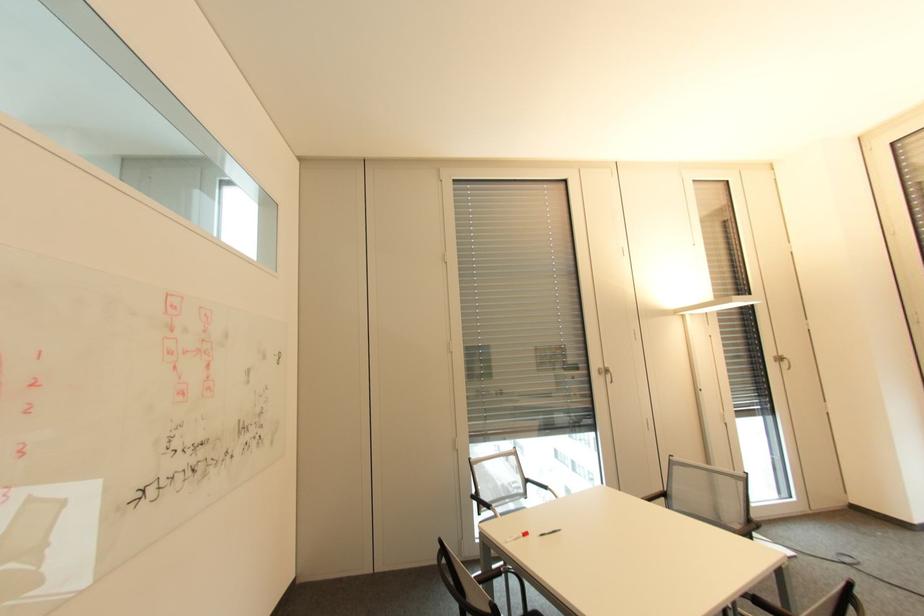
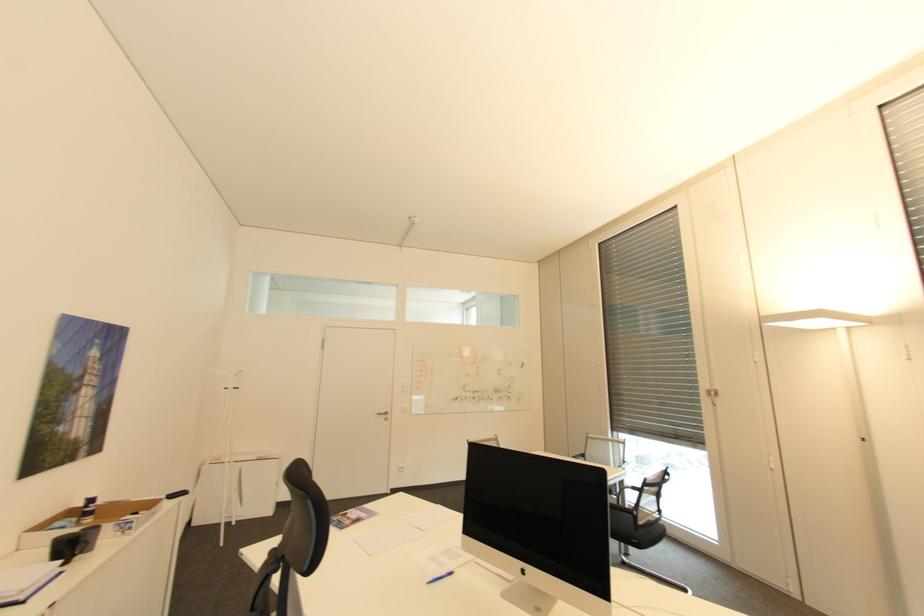
Find the pixel in the second image that matches (x=605, y=367) in the first image.

(713, 387)